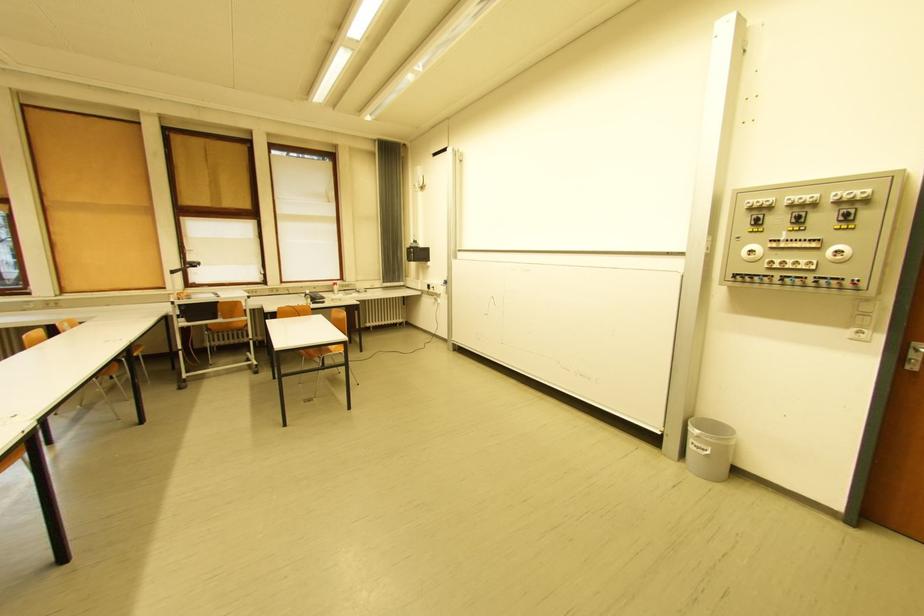
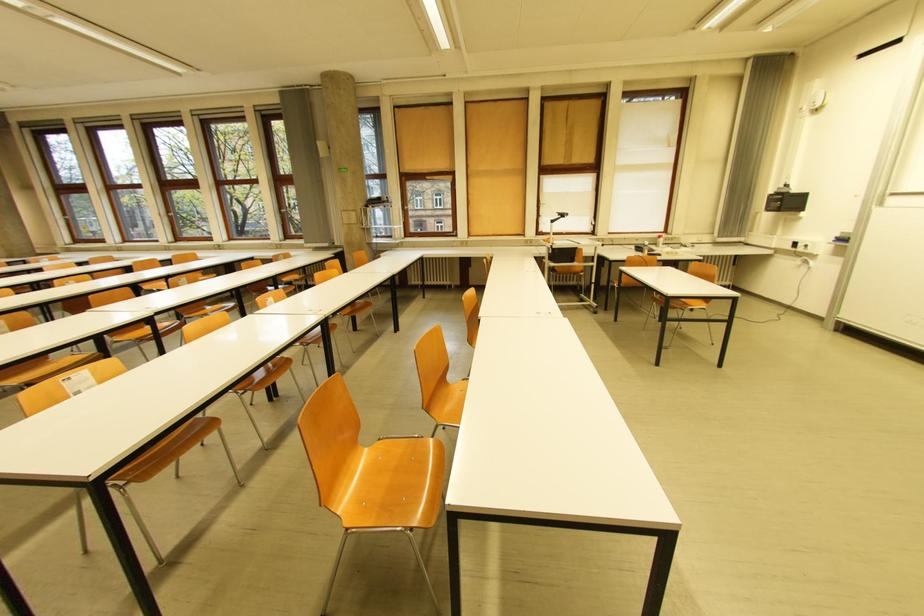
Find the pixel in the second image that matches (338,286) in the first image.

(662, 240)